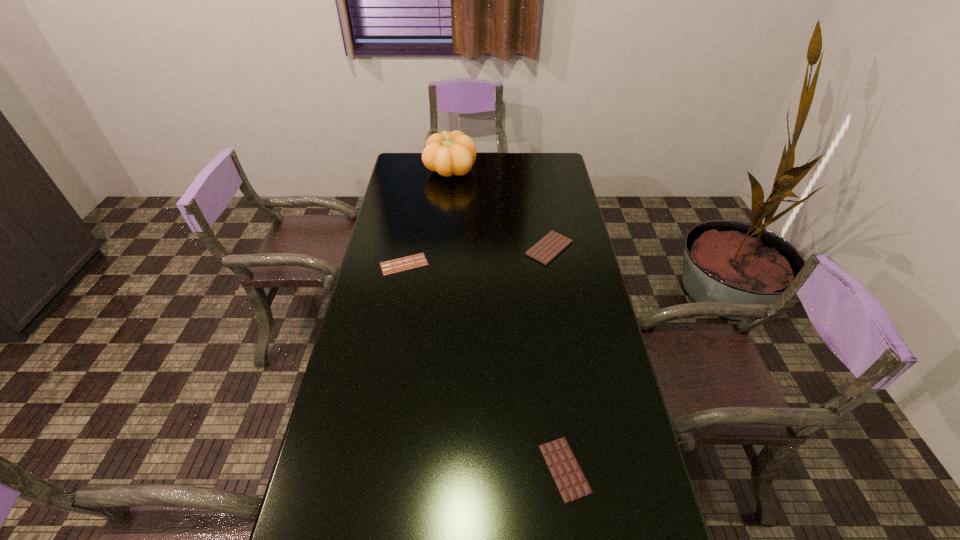
Locate an element on the screen. pumpkin that is at the left edge is located at coordinates (449, 153).

Locate an element on the screen. chocolate bar at the left edge is located at coordinates (418, 260).

This screenshot has width=960, height=540. I want to click on object located in the far left corner section of the desktop, so click(x=449, y=153).

The image size is (960, 540). I want to click on vacant point at the far edge, so click(501, 168).

You are a GUI agent. You are given a task and a screenshot of the screen. Output one action in this format:
    pyautogui.click(x=<x>, y=<y>)
    Task: Click on the free space at the left edge of the desktop
    The width and height of the screenshot is (960, 540).
    Given the screenshot: What is the action you would take?
    pyautogui.click(x=386, y=346)

You are a GUI agent. You are given a task and a screenshot of the screen. Output one action in this format:
    pyautogui.click(x=<x>, y=<y>)
    Task: Click on the vacant region at the right edge
    The height and width of the screenshot is (540, 960).
    Given the screenshot: What is the action you would take?
    pyautogui.click(x=538, y=199)

Where is `vacant area at the far left corner`? This screenshot has height=540, width=960. vacant area at the far left corner is located at coordinates (396, 163).

The height and width of the screenshot is (540, 960). What are the coordinates of `unoccupied area between the tallest object and the nearest chocolate bar` in the screenshot? It's located at (508, 320).

Image resolution: width=960 pixels, height=540 pixels. What are the coordinates of `vacant area between the pumpkin and the nearest object` in the screenshot? It's located at (508, 320).

Image resolution: width=960 pixels, height=540 pixels. I want to click on free space between the farthest object and the third shortest object, so click(500, 210).